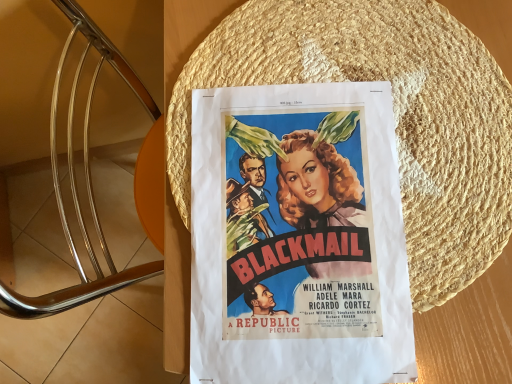
Image resolution: width=512 pixels, height=384 pixels. Describe the element at coordinates (298, 237) in the screenshot. I see `matte paper poster at center` at that location.

Locate an element on the screen. matte paper poster at center is located at coordinates click(x=298, y=237).

Where is `matte paper poster at center`? The image size is (512, 384). matte paper poster at center is located at coordinates click(298, 237).